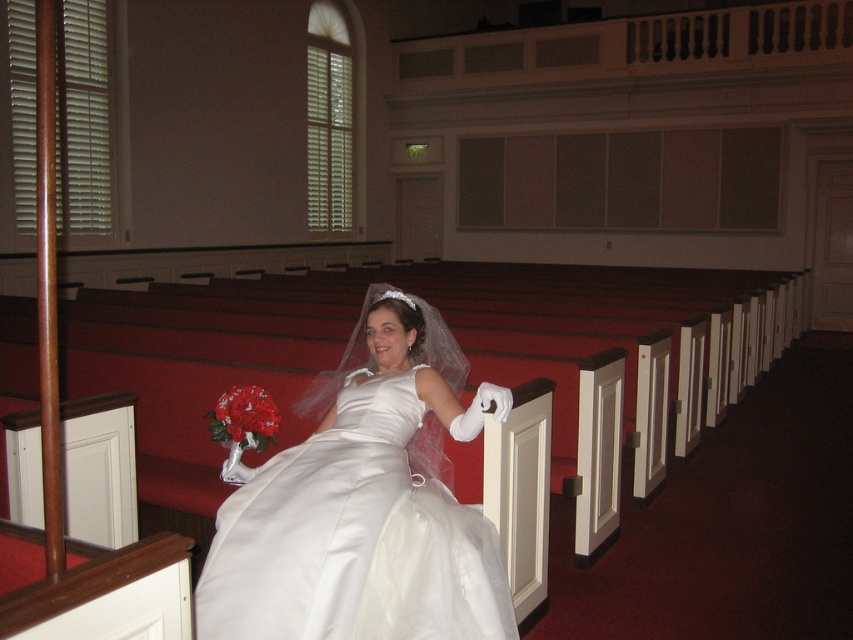
Who is shorter, satin dress at center or red satin bouquet at center?

With less height is red satin bouquet at center.

Is satin dress at center smaller than red satin bouquet at center?

Incorrect, satin dress at center is not smaller in size than red satin bouquet at center.

What do you see at coordinates (364, 502) in the screenshot?
I see `satin dress at center` at bounding box center [364, 502].

Find the location of a particular element. The height and width of the screenshot is (640, 853). satin dress at center is located at coordinates (364, 502).